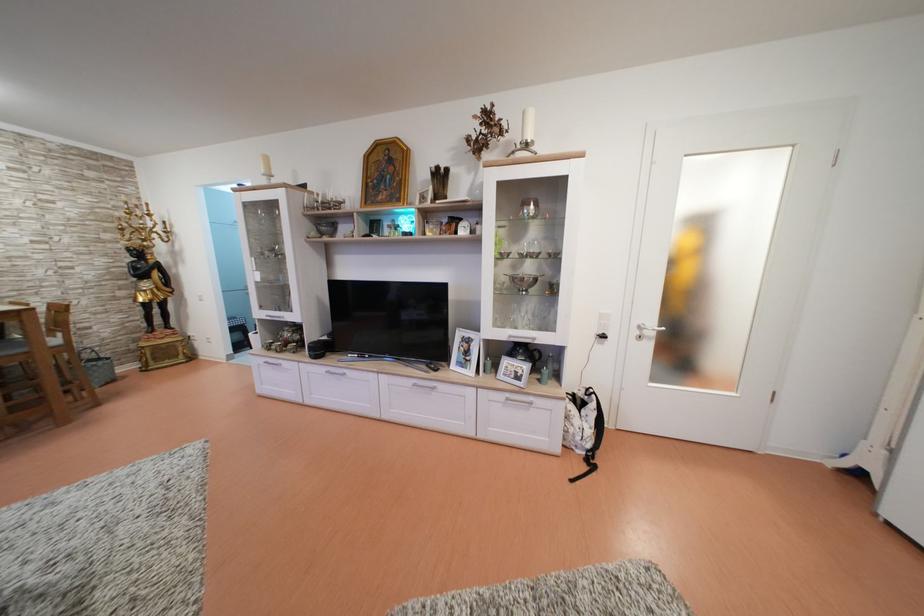
Find where to lift the black remote control. Please return your answer as a coordinate pair (x, y).

(432, 365)